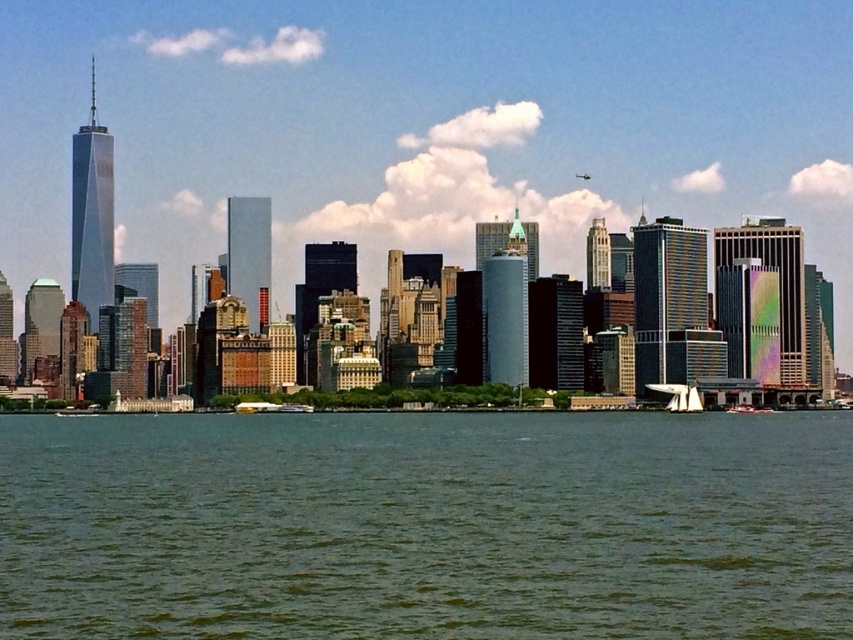
Question: Which of the following is the closest to the observer?

Choices:
 (A) (115, 464)
 (B) (744, 410)

Answer: (A)

Question: In this image, where is yellow plastic boat at lower center located relative to white plastic sailboat at lower right?

Choices:
 (A) below
 (B) above

Answer: (B)

Question: Is green water at lower center further to the viewer compared to yellow plastic boat at lower center?

Choices:
 (A) no
 (B) yes

Answer: (A)

Question: Estimate the real-world distances between objects in this image. Which object is farther from the white plastic sailboat at lower right?

Choices:
 (A) yellow plastic boat at lower center
 (B) green water at lower center

Answer: (A)

Question: Which object is the closest to the yellow plastic boat at lower center?

Choices:
 (A) white plastic sailboat at lower right
 (B) green water at lower center

Answer: (B)

Question: Is yellow plastic boat at lower center behind white plastic sailboat at lower right?

Choices:
 (A) yes
 (B) no

Answer: (B)